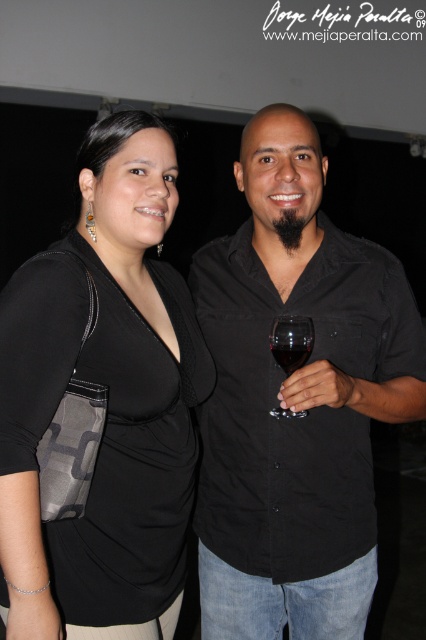
You are taking a photo of two people at a social event. You notice two points in the image labeled as point 1 and point 2. Point 1 is located at coordinates (282, 355) and point 2 is at (281, 353). If you want to focus on the closer point to ensure sharpness, which point should you choose?

Point 1 at coordinates (282, 355) is closer to the camera, so you should focus on point 1 to ensure sharpness.

You are at a social event and want to know if the point at coordinates point [345,620] is behind point [270,340]. Can you determine this based on the scene?

Yes, according to the scene description, point [345,620] is behind point [270,340].